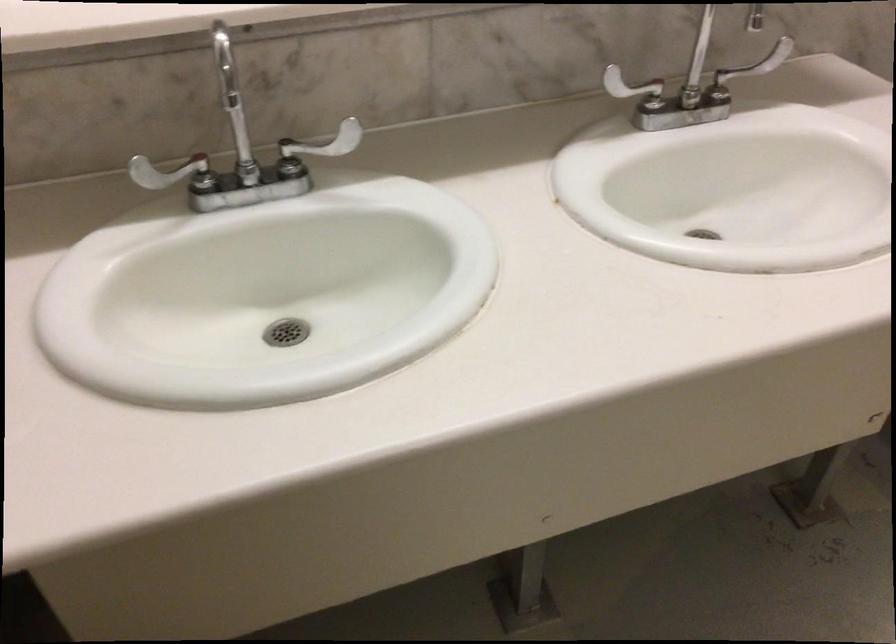
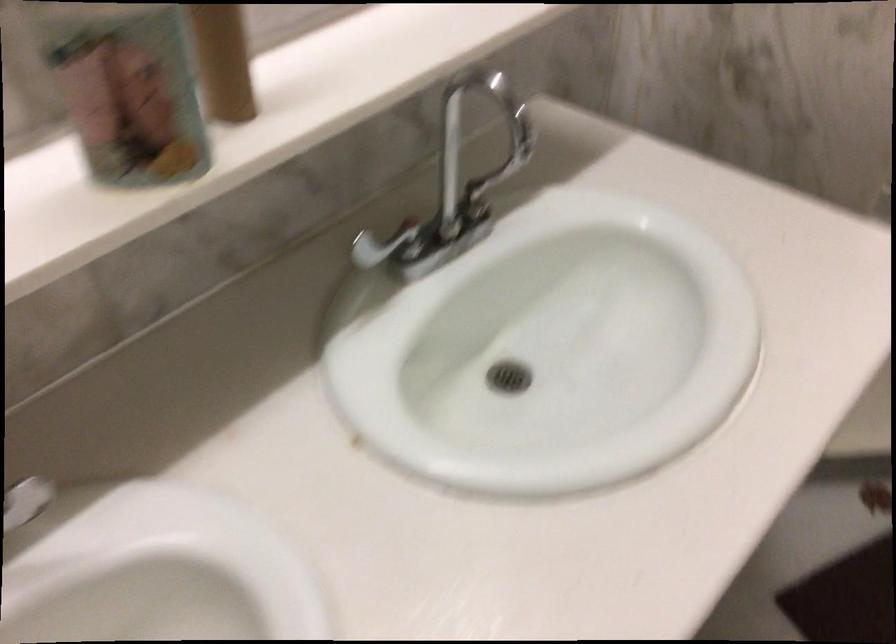
Question: The first image is from the beginning of the video and the second image is from the end. How did the camera likely rotate when shooting the video?

Choices:
 (A) Left
 (B) Right
 (C) Up
 (D) Down

Answer: (B)